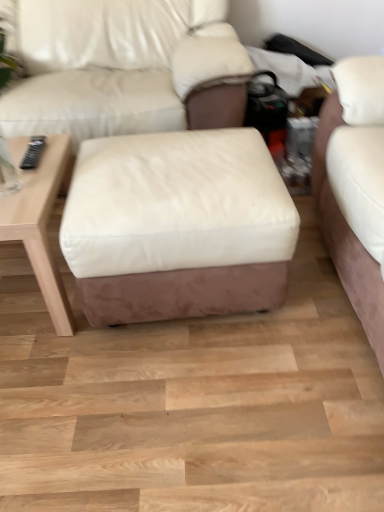
Image resolution: width=384 pixels, height=512 pixels. Identify the location of vacant space situated above wooden table at left (from a real-world perspective). (28, 170).